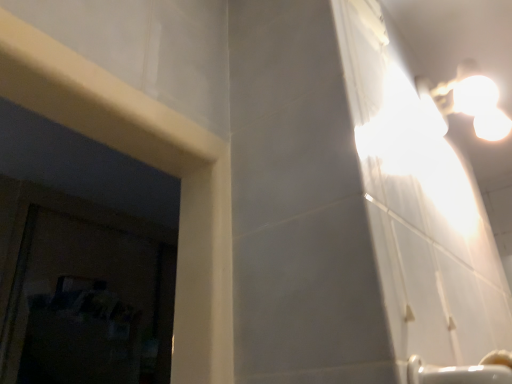
Question: Choose the correct answer: Is white ceramic faucet at lower right inside white glossy light fixture at upper right or outside it?

Choices:
 (A) outside
 (B) inside

Answer: (A)

Question: In terms of size, does white ceramic faucet at lower right appear bigger or smaller than white glossy light fixture at upper right?

Choices:
 (A) big
 (B) small

Answer: (B)

Question: In terms of width, does white ceramic faucet at lower right look wider or thinner when compared to white glossy light fixture at upper right?

Choices:
 (A) wide
 (B) thin

Answer: (B)

Question: Is point (483, 114) closer or farther from the camera than point (415, 375)?

Choices:
 (A) closer
 (B) farther

Answer: (B)

Question: Is white glossy light fixture at upper right to the left or to the right of white ceramic faucet at lower right in the image?

Choices:
 (A) left
 (B) right

Answer: (B)

Question: In terms of size, does white glossy light fixture at upper right appear bigger or smaller than white ceramic faucet at lower right?

Choices:
 (A) big
 (B) small

Answer: (A)

Question: From their relative heights in the image, would you say white glossy light fixture at upper right is taller or shorter than white ceramic faucet at lower right?

Choices:
 (A) tall
 (B) short

Answer: (A)